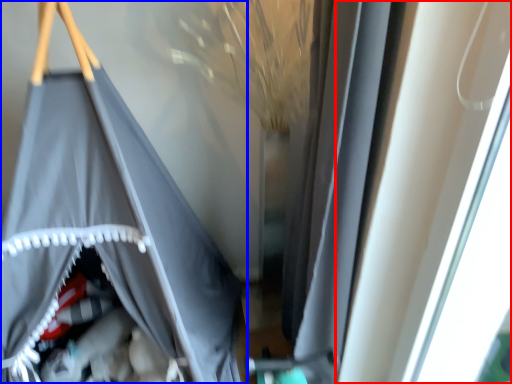
Question: Which object is closer to the camera taking this photo, window (highlighted by a red box) or curtain (highlighted by a blue box)?

Choices:
 (A) window
 (B) curtain

Answer: (A)